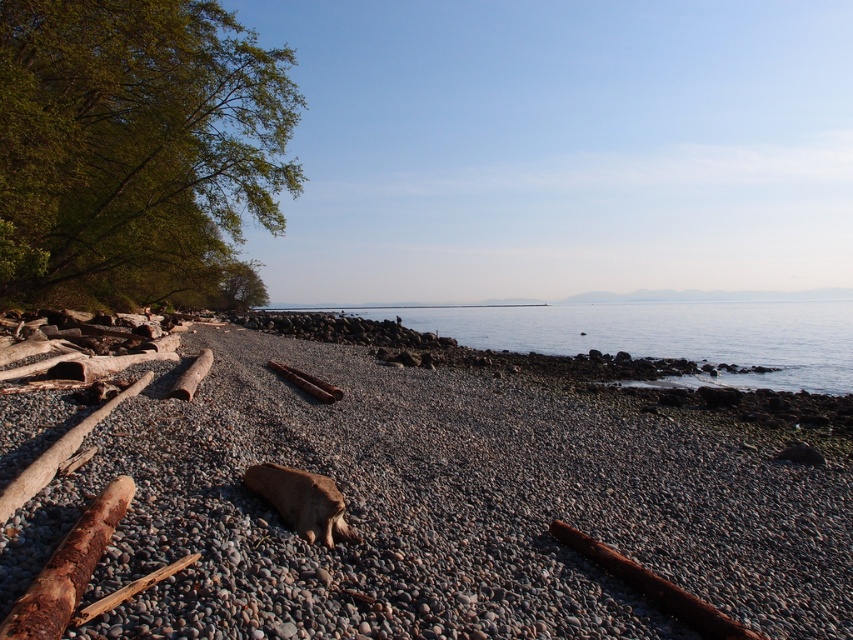
Does point (61, 579) lie behind point (234, 285)?

No, (61, 579) is in front of (234, 285).

At what (x,y) coordinates should I click in order to perform the action: click on brown rough log at lower left. Please return your answer as a coordinate pair (x, y). The image size is (853, 640). Looking at the image, I should click on (67, 568).

Find the location of a particular element. brown rough log at lower left is located at coordinates (67, 568).

This screenshot has height=640, width=853. I want to click on brown rough log at lower left, so click(67, 568).

Can you confirm if smooth pebbles at center is positioned to the left of green leafy tree at upper left?

In fact, smooth pebbles at center is to the right of green leafy tree at upper left.

Is smooth pebbles at center bigger than green leafy tree at upper left?

No.

This screenshot has width=853, height=640. What are the coordinates of `smooth pebbles at center` in the screenshot? It's located at (438, 508).

This screenshot has width=853, height=640. I want to click on smooth pebbles at center, so click(x=438, y=508).

The height and width of the screenshot is (640, 853). Find the location of `green leafy tree at upper left`. green leafy tree at upper left is located at coordinates (134, 147).

Does green leafy tree at upper left appear on the left side of clear water at center?

Yes, green leafy tree at upper left is to the left of clear water at center.

The image size is (853, 640). I want to click on green leafy tree at upper left, so point(134,147).

The image size is (853, 640). In order to click on green leafy tree at upper left in this screenshot , I will do `click(134, 147)`.